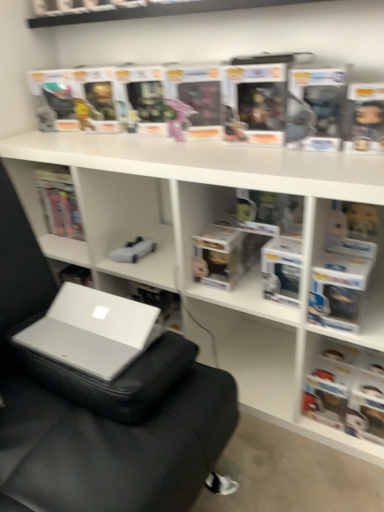
Question: From the image's perspective, would you say silver/glossy laptop at lower left is positioned over matte black book at right?

Choices:
 (A) no
 (B) yes

Answer: (B)

Question: Could you tell me if silver/glossy laptop at lower left is turned towards matte black book at right?

Choices:
 (A) no
 (B) yes

Answer: (A)

Question: Is silver/glossy laptop at lower left facing away from matte black book at right?

Choices:
 (A) yes
 (B) no

Answer: (B)

Question: From the image's perspective, is silver/glossy laptop at lower left beneath matte black book at right?

Choices:
 (A) yes
 (B) no

Answer: (B)

Question: Is the depth of silver/glossy laptop at lower left less than that of matte black book at right?

Choices:
 (A) no
 (B) yes

Answer: (B)

Question: From a real-world perspective, is silver/glossy laptop at lower left located beneath matte black book at right?

Choices:
 (A) yes
 (B) no

Answer: (B)

Question: Is gray fabric bean bag chair at center positioned far away from silver/glossy laptop at lower left?

Choices:
 (A) yes
 (B) no

Answer: (B)

Question: Can we say gray fabric bean bag chair at center lies outside silver/glossy laptop at lower left?

Choices:
 (A) yes
 (B) no

Answer: (A)

Question: Is gray fabric bean bag chair at center positioned behind silver/glossy laptop at lower left?

Choices:
 (A) yes
 (B) no

Answer: (B)

Question: Considering the relative sizes of gray fabric bean bag chair at center and silver/glossy laptop at lower left in the image provided, is gray fabric bean bag chair at center bigger than silver/glossy laptop at lower left?

Choices:
 (A) yes
 (B) no

Answer: (A)

Question: Can you confirm if gray fabric bean bag chair at center is shorter than silver/glossy laptop at lower left?

Choices:
 (A) yes
 (B) no

Answer: (B)

Question: Is gray fabric bean bag chair at center closer to camera compared to silver/glossy laptop at lower left?

Choices:
 (A) no
 (B) yes

Answer: (B)

Question: Is gray fabric bean bag chair at center surrounded by silver/glossy laptop at lower left?

Choices:
 (A) yes
 (B) no

Answer: (B)